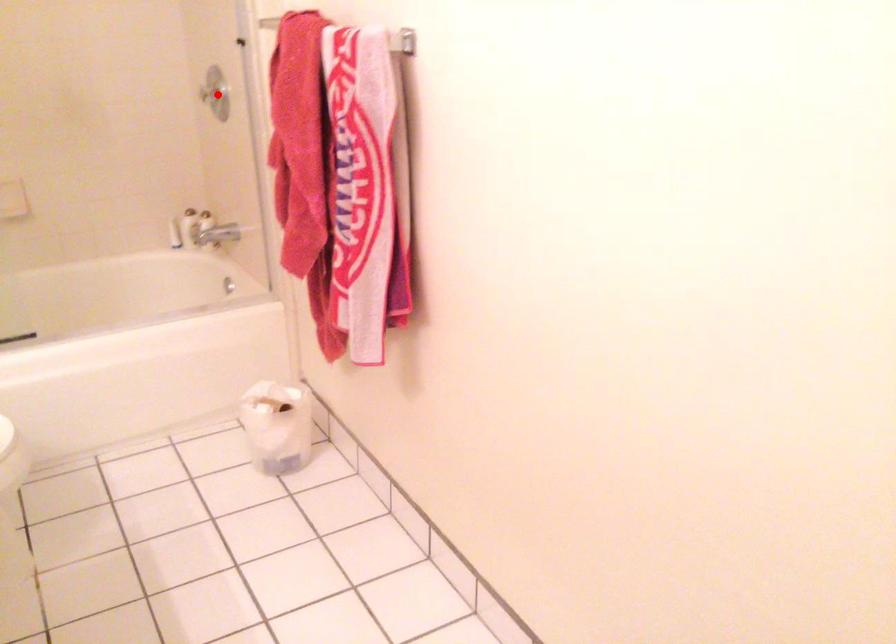
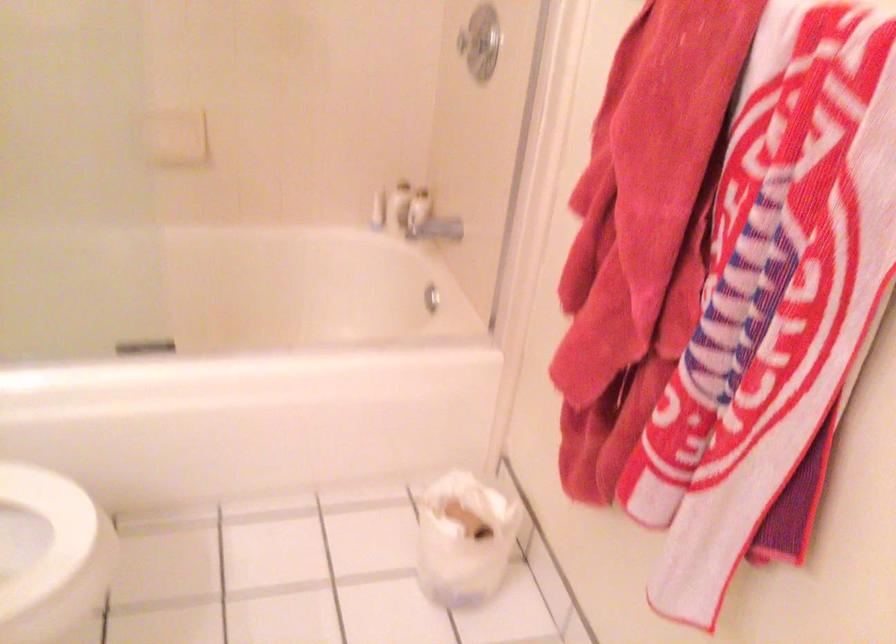
Where in the second image is the point corresponding to the highlighted location from the first image?

(478, 42)